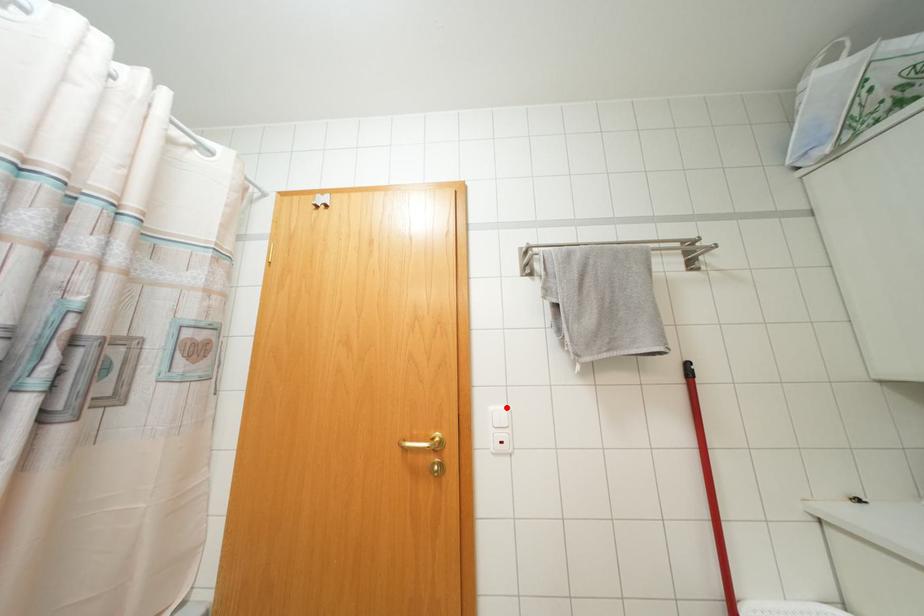
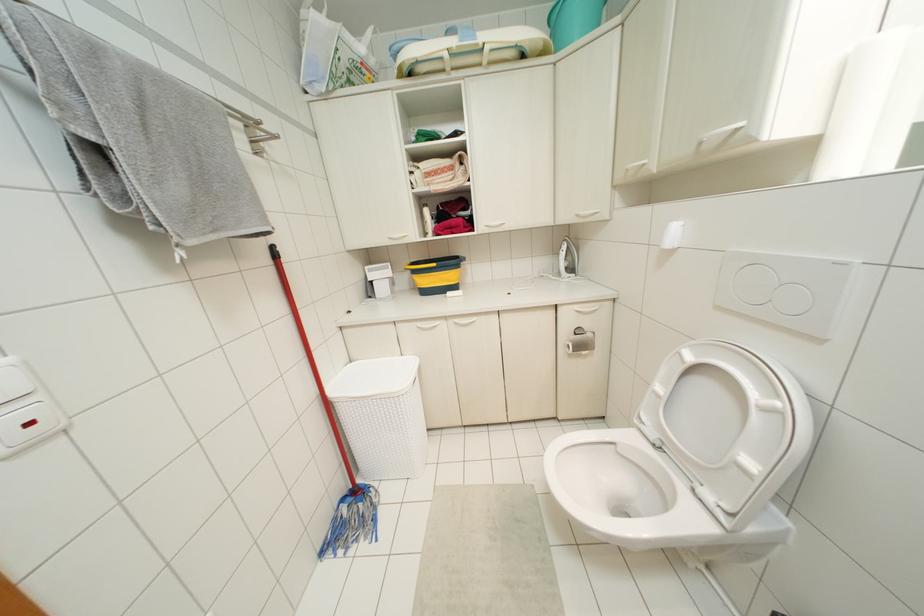
The point at the highlighted location is marked in the first image. Where is the corresponding point in the second image?

(7, 360)